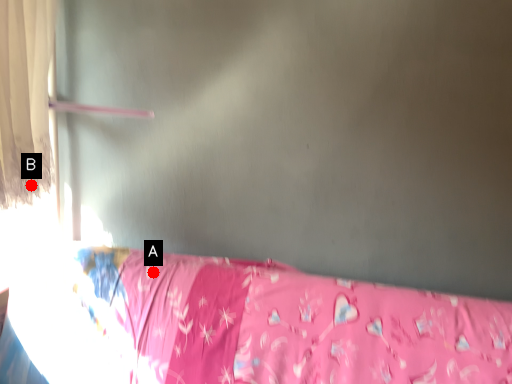
Question: Two points are circled on the image, labeled by A and B beside each circle. Which point is farther to the camera?

Choices:
 (A) A is further
 (B) B is further

Answer: (A)